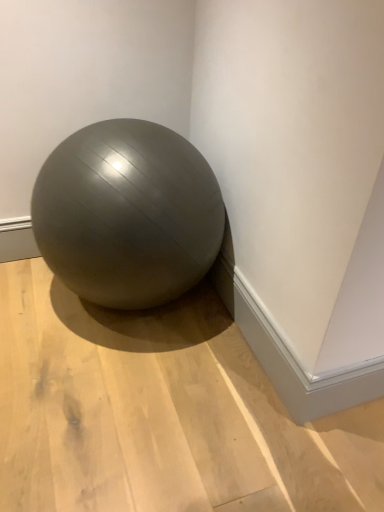
The height and width of the screenshot is (512, 384). I want to click on vacant area that is in front of satin gray ball at center, so click(133, 411).